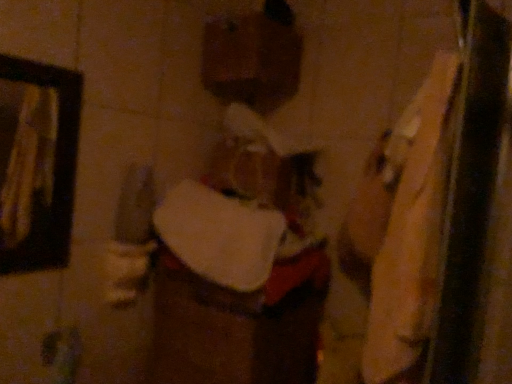
The image size is (512, 384). Describe the element at coordinates (248, 171) in the screenshot. I see `matte brown head at center` at that location.

You are a GUI agent. You are given a task and a screenshot of the screen. Output one action in this format:
    pyautogui.click(x=<x>, y=<y>)
    Task: Click on the matte brown head at center
    The height and width of the screenshot is (384, 512).
    Given the screenshot: What is the action you would take?
    pyautogui.click(x=248, y=171)

Locate an element on the screen. Image resolution: width=512 pixels, height=384 pixels. matte brown head at center is located at coordinates (248, 171).